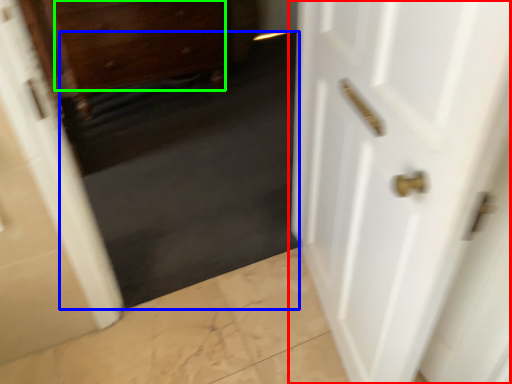
Question: Based on their relative distances, which object is farther from door (highlighted by a red box)? Choose from dark (highlighted by a blue box) and drawer (highlighted by a green box).

Choices:
 (A) dark
 (B) drawer

Answer: (B)